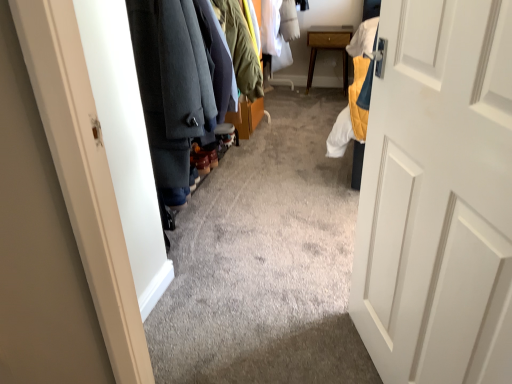
Image resolution: width=512 pixels, height=384 pixels. I want to click on wooden nightstand at center, so (x=328, y=47).

Describe the element at coordinates (328, 47) in the screenshot. The image size is (512, 384). I see `wooden nightstand at center` at that location.

I want to click on wooden nightstand at center, so click(x=328, y=47).